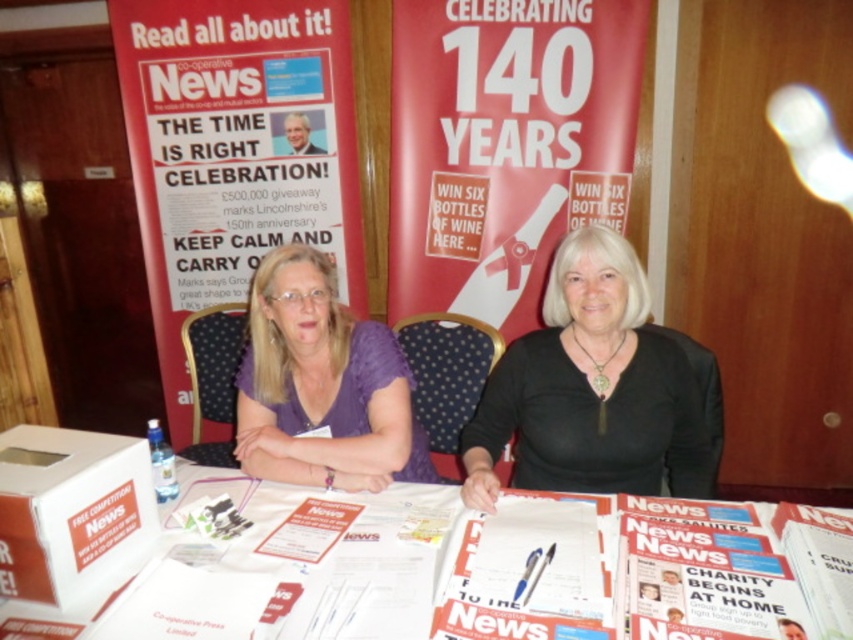
You are organizing a promotional event and need to place a 12.5 inch wide promotional item between the black matte shirt at center and the white glossy magazine at center. Can you fit it there?

The black matte shirt at center and white glossy magazine at center are 12.76 inches apart, so yes, the promotional item which is 12.5 inches wide can fit between them as the space is slightly larger than the item.

You are standing in front of the table where the two women are seated. There are two points marked on the table surface. The first point is at coordinates point (691, 534) and the second point is at point (537, 513). Which of these two points is closer to you?

Point (691, 534) is closer to the viewer than point (537, 513).

You are organizing a promotional event and need to ensure that the red cardboard poster at upper left and the black matte shirt at center are visible to attendees. Given that the poster is wider than the shirt, which object should be placed closer to the center of the table to maximize visibility?

Result: The red cardboard poster at upper left should be placed closer to the center of the table since it is wider than the black matte shirt at center, ensuring better visibility for attendees.